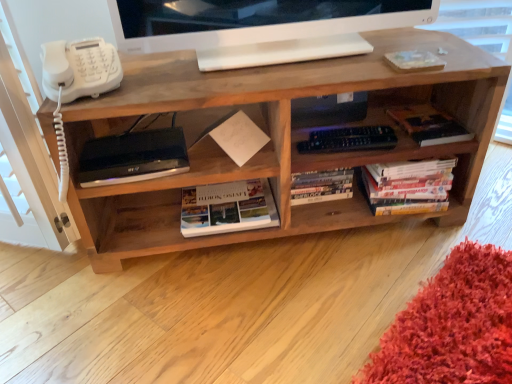
The width and height of the screenshot is (512, 384). In order to click on vacant area situated below white glossy monitor at upper center (from a real-world perspective) in this screenshot , I will do `click(302, 49)`.